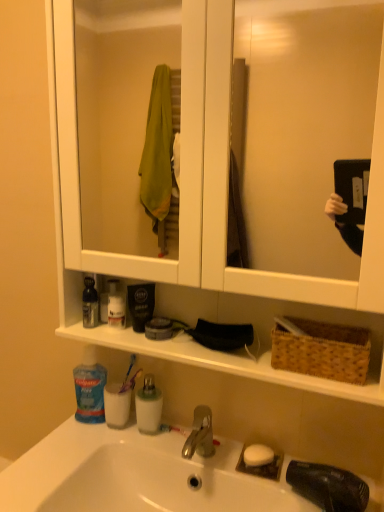
What are the coordinates of `free point in front of blue plastic toothpaste at lower left` in the screenshot? It's located at (66, 454).